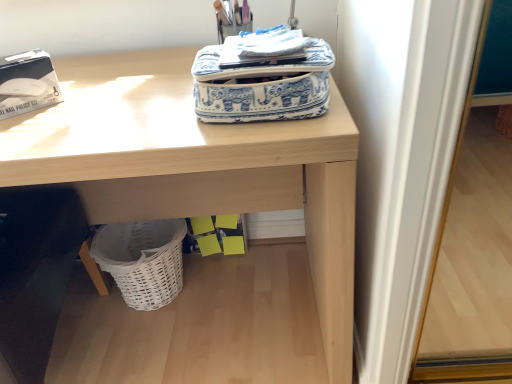
This screenshot has width=512, height=384. I want to click on vacant area situated below wooden desk at upper center (from a real-world perspective), so point(204,324).